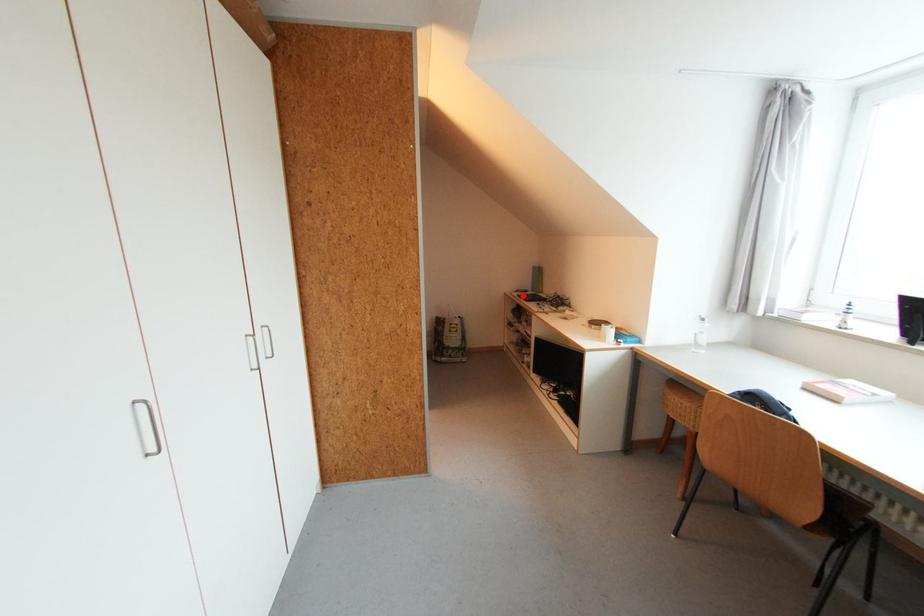
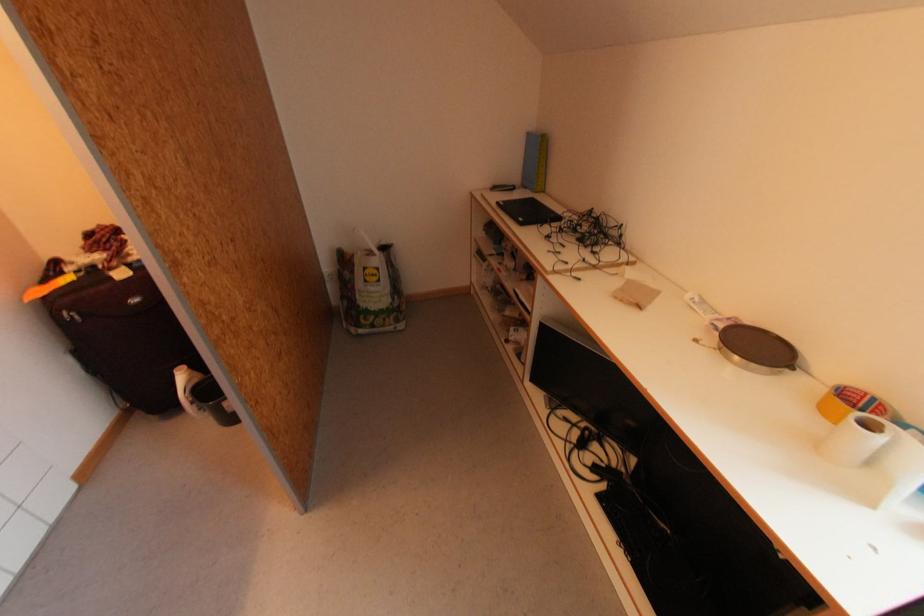
In the second image, find the point that corresponds to the highlighted location in the first image.

(503, 205)